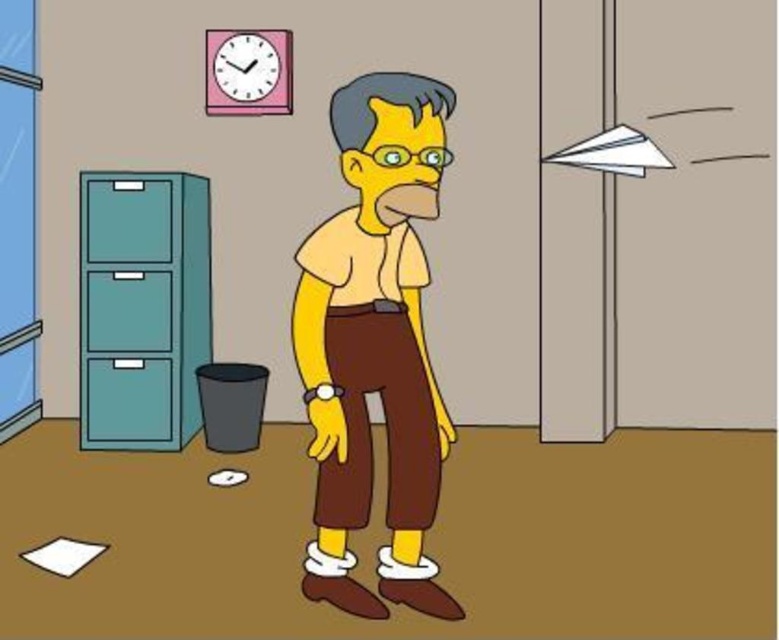
Question: Which of these objects is positioned closest to the teal matte/file cabinet at left?

Choices:
 (A) pink matte clock at upper center
 (B) matte brown pants at center

Answer: (A)

Question: Does matte brown pants at center have a smaller size compared to teal matte/file cabinet at left?

Choices:
 (A) yes
 (B) no

Answer: (B)

Question: Is matte brown pants at center above teal matte/file cabinet at left?

Choices:
 (A) yes
 (B) no

Answer: (B)

Question: Which point is farther from the camera taking this photo?

Choices:
 (A) (321, 577)
 (B) (217, 77)
 (C) (185, 204)

Answer: (B)

Question: Is teal matte/file cabinet at left wider than pink matte clock at upper center?

Choices:
 (A) yes
 (B) no

Answer: (A)

Question: Among these objects, which one is farthest from the camera?

Choices:
 (A) pink matte clock at upper center
 (B) teal matte/file cabinet at left
 (C) matte brown pants at center

Answer: (A)